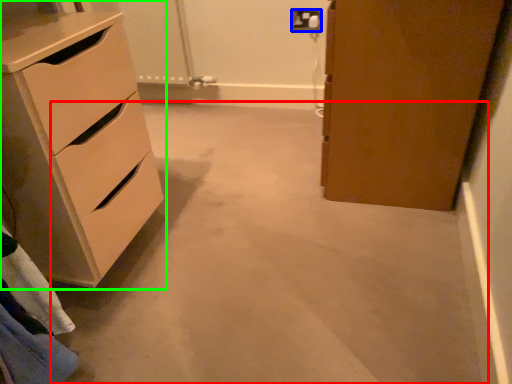
Question: Based on their relative distances, which object is farther from concrete (highlighted by a red box)? Choose from electric outlet (highlighted by a blue box) and chest of drawers (highlighted by a green box).

Choices:
 (A) electric outlet
 (B) chest of drawers

Answer: (A)